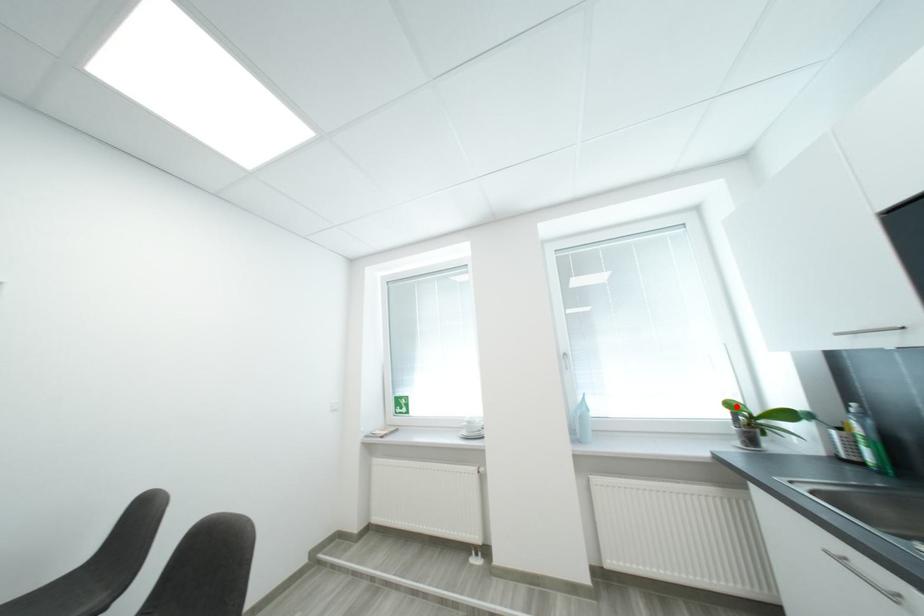
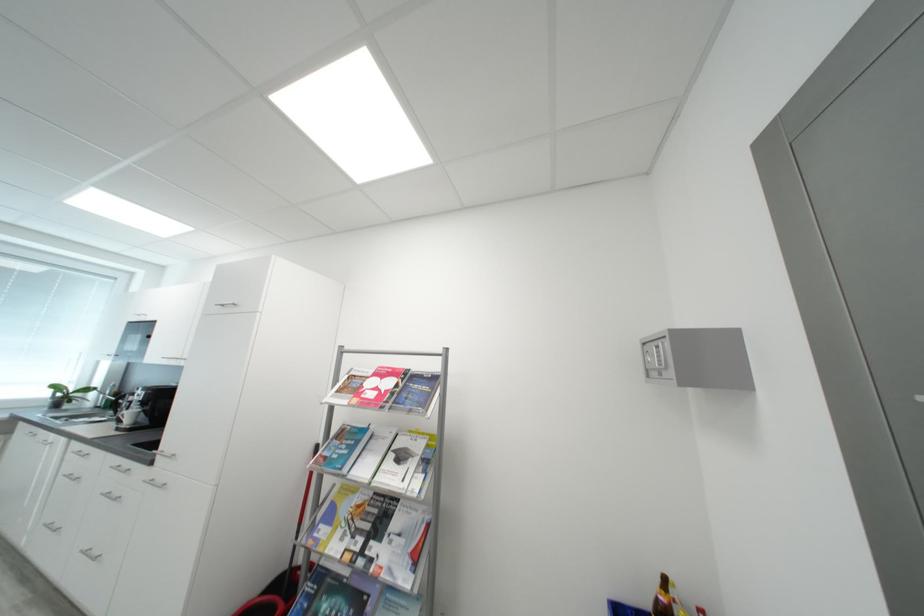
Question: A red point is marked in image1. In image2, is the corresponding 3D point closer to the camera or farther? Reply with the corresponding letter.

Choices:
 (A) The corresponding 3D point is closer.
 (B) The corresponding 3D point is farther.

Answer: (A)